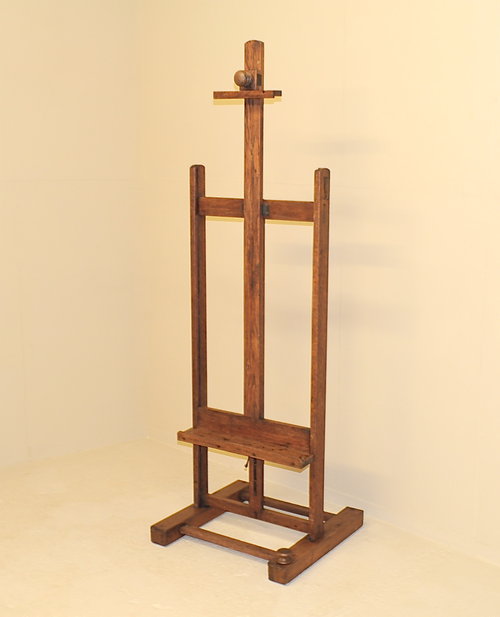
Identify the location of floor. Image resolution: width=500 pixels, height=617 pixels. pos(90,532).